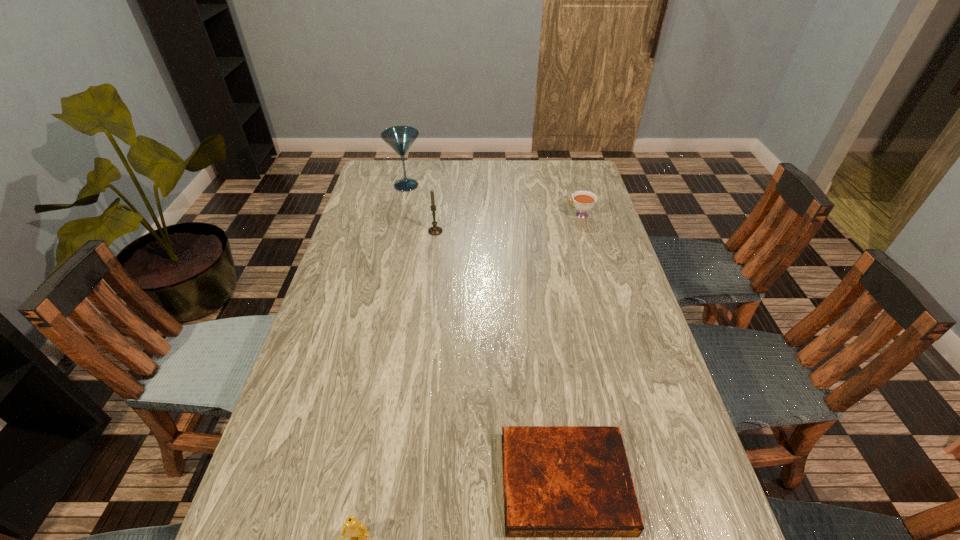
Where is `martini`? This screenshot has width=960, height=540. martini is located at coordinates (400, 138).

The height and width of the screenshot is (540, 960). I want to click on the farthest object, so click(x=400, y=138).

Where is `the third object from right to left`? Image resolution: width=960 pixels, height=540 pixels. the third object from right to left is located at coordinates (435, 230).

What are the coordinates of `candle` in the screenshot? It's located at (435, 230).

This screenshot has width=960, height=540. Identify the location of teacup. (583, 201).

Identify the location of the second farthest object. (583, 201).

The image size is (960, 540). I want to click on the shortest object, so click(559, 481).

What are the coordinates of `the fourth object from left to right` in the screenshot? It's located at (559, 481).

This screenshot has width=960, height=540. Find the location of `vacant area situated 0.270m on the front of the farthest object`. vacant area situated 0.270m on the front of the farthest object is located at coordinates (395, 239).

The width and height of the screenshot is (960, 540). What are the coordinates of `vacant space located 0.190m on the front of the third farthest object` in the screenshot? It's located at (430, 273).